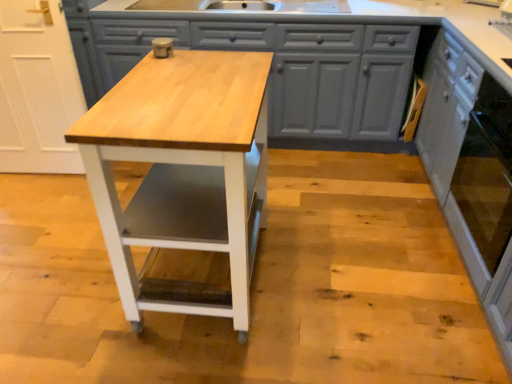
Question: From a real-world perspective, is natural wood table at center under matte gray cabinets at center, which is the second cabinetry from right to left?

Choices:
 (A) yes
 (B) no

Answer: (B)

Question: Is natural wood table at center aimed at matte gray cabinets at center, which is the second cabinetry from right to left?

Choices:
 (A) yes
 (B) no

Answer: (B)

Question: Is natural wood table at center wider than matte gray cabinets at center, placed as the first cabinetry when sorted from left to right?

Choices:
 (A) yes
 (B) no

Answer: (B)

Question: Considering the relative positions of natural wood table at center and matte gray cabinets at center, placed as the first cabinetry when sorted from left to right, in the image provided, is natural wood table at center to the left of matte gray cabinets at center, placed as the first cabinetry when sorted from left to right, from the viewer's perspective?

Choices:
 (A) yes
 (B) no

Answer: (A)

Question: Can you confirm if natural wood table at center is thinner than matte gray cabinets at center, which is the second cabinetry from right to left?

Choices:
 (A) yes
 (B) no

Answer: (A)

Question: Considering the relative positions of natural wood table at center and matte gray cabinets at center, which is the second cabinetry from right to left, in the image provided, is natural wood table at center in front of matte gray cabinets at center, which is the second cabinetry from right to left,?

Choices:
 (A) yes
 (B) no

Answer: (A)

Question: From a real-world perspective, is natural wood table at center under white painted wood cabinet at right, marked as the second cabinetry in a left-to-right arrangement?

Choices:
 (A) yes
 (B) no

Answer: (B)

Question: From the image's perspective, is natural wood table at center on top of white painted wood cabinet at right, marked as the second cabinetry in a left-to-right arrangement?

Choices:
 (A) no
 (B) yes

Answer: (A)

Question: From a real-world perspective, is natural wood table at center on top of white painted wood cabinet at right, arranged as the 1th cabinetry when viewed from the right?

Choices:
 (A) yes
 (B) no

Answer: (A)

Question: Considering the relative sizes of natural wood table at center and white painted wood cabinet at right, arranged as the 1th cabinetry when viewed from the right, in the image provided, is natural wood table at center taller than white painted wood cabinet at right, arranged as the 1th cabinetry when viewed from the right,?

Choices:
 (A) no
 (B) yes

Answer: (A)

Question: From the image's perspective, does natural wood table at center appear lower than white painted wood cabinet at right, arranged as the 1th cabinetry when viewed from the right?

Choices:
 (A) no
 (B) yes

Answer: (B)

Question: Could you tell me if natural wood table at center is turned towards white painted wood cabinet at right, arranged as the 1th cabinetry when viewed from the right?

Choices:
 (A) no
 (B) yes

Answer: (A)

Question: From a real-world perspective, is matte gray cabinets at center, which is the second cabinetry from right to left, below white painted wood cabinet at right, arranged as the 1th cabinetry when viewed from the right?

Choices:
 (A) yes
 (B) no

Answer: (A)